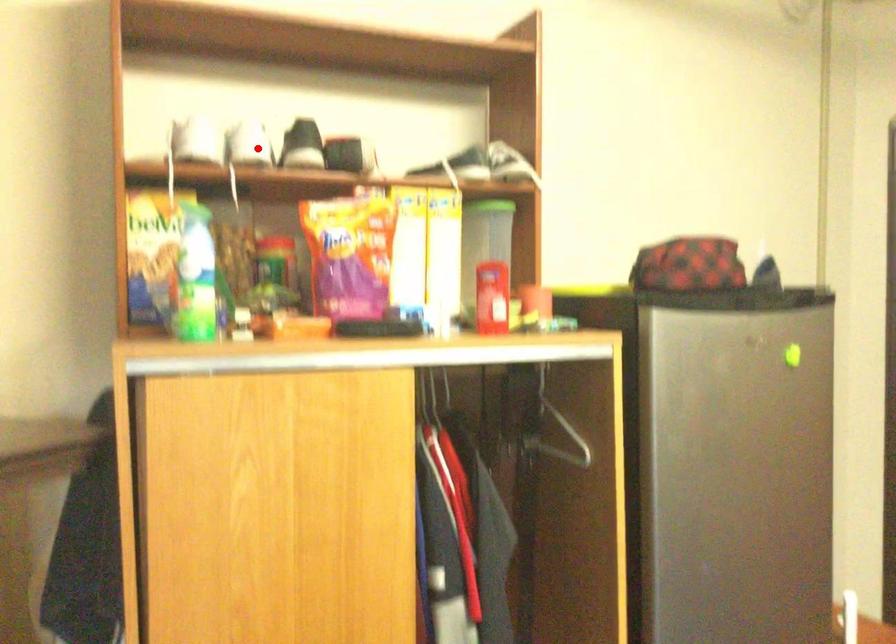
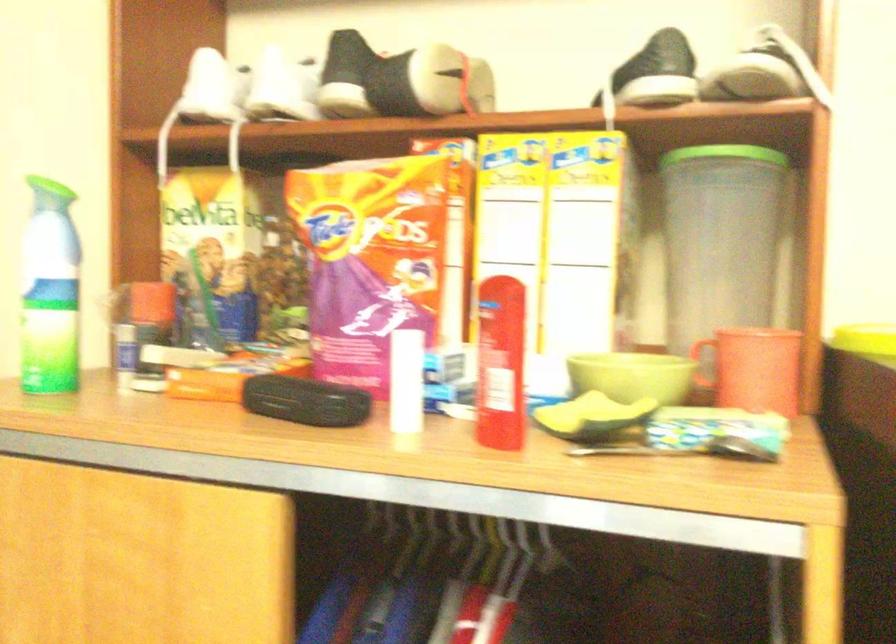
The point at the highlighted location is marked in the first image. Where is the corresponding point in the second image?

(280, 88)